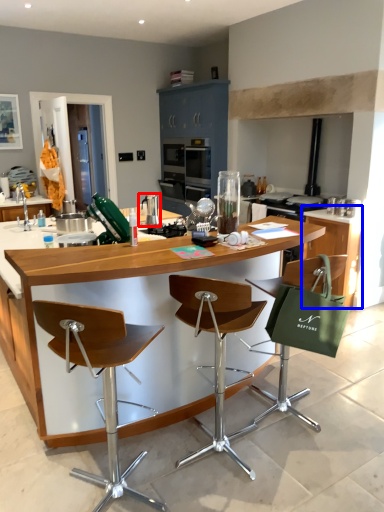
Question: Which object is closer to the camera taking this photo, appliance (highlighted by a red box) or cabinetry (highlighted by a blue box)?

Choices:
 (A) appliance
 (B) cabinetry

Answer: (A)